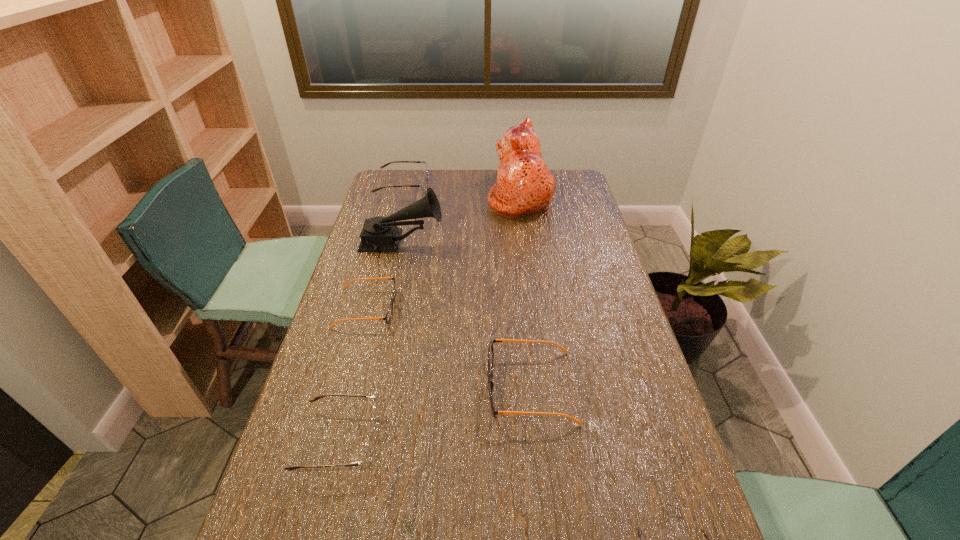
Where is `cat at the far edge`? cat at the far edge is located at coordinates (524, 185).

Image resolution: width=960 pixels, height=540 pixels. What are the coordinates of `spectacles positioned at the far edge` in the screenshot? It's located at (423, 185).

Where is `phonograph_record located in the left edge section of the desktop`? This screenshot has width=960, height=540. phonograph_record located in the left edge section of the desktop is located at coordinates (379, 234).

Identify the location of object that is at the right edge. This screenshot has height=540, width=960. (524, 185).

At what (x,y) coordinates should I click in order to perform the action: click on object that is at the far left corner. Please return your answer as a coordinate pair (x, y). Looking at the image, I should click on (423, 185).

Where is `object at the far right corner`? object at the far right corner is located at coordinates point(524,185).

In the image, there is a desktop. Where is `blank space at the left edge`? The width and height of the screenshot is (960, 540). blank space at the left edge is located at coordinates (306, 444).

This screenshot has width=960, height=540. I want to click on free space at the right edge of the desktop, so click(612, 264).

This screenshot has width=960, height=540. In order to click on free space at the far left corner in this screenshot , I will do `click(387, 184)`.

At what (x,y) coordinates should I click in order to perform the action: click on empty location between the farthest spectacles and the second smallest brown spectacles. Please return your answer as a coordinate pair (x, y). This screenshot has width=960, height=540. Looking at the image, I should click on (371, 313).